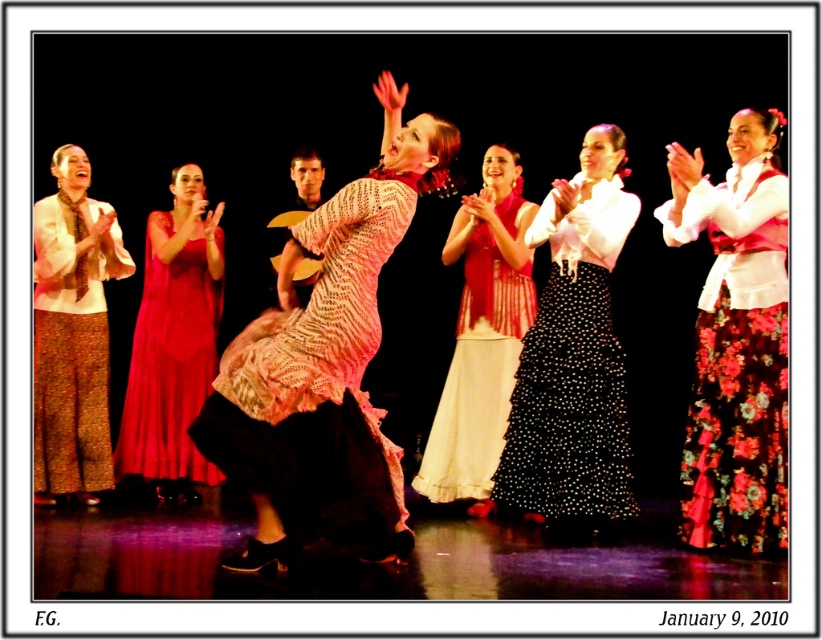
From the picture: You are a photographer taking a picture of the flamenco performance. You notice the point at coordinates (72, 332) in the image. What object is located at that point?

The matte brown skirt at center is located at point (72, 332).

You are a photographer trying to capture the flamenco performance. You notice two points in the scene, one at point [758,196] and the other at point [492,417]. Which point should you focus on to ensure it appears larger in your photo?

Point [758,196] should be focused on because it is closer to the camera and will appear larger in the photo compared to point [492,417].